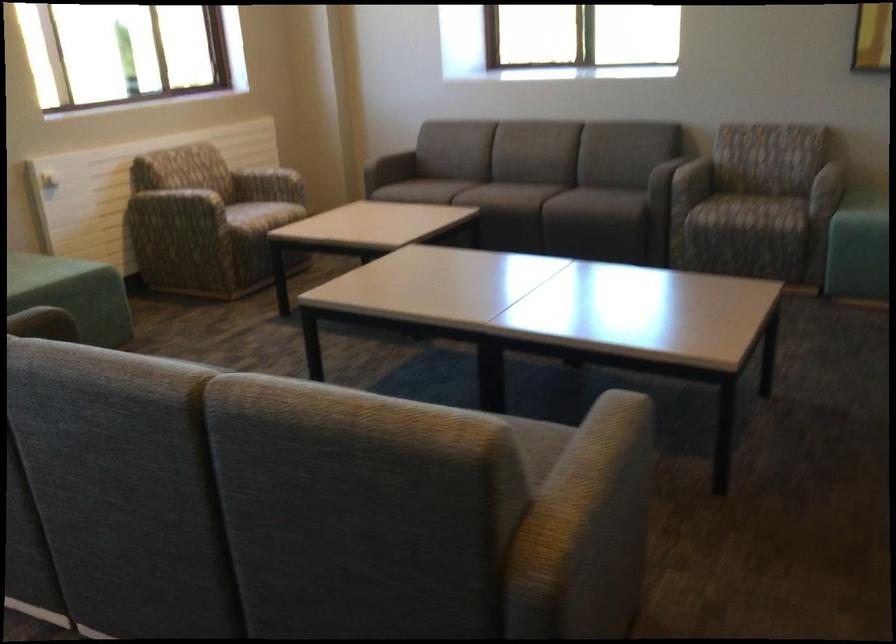
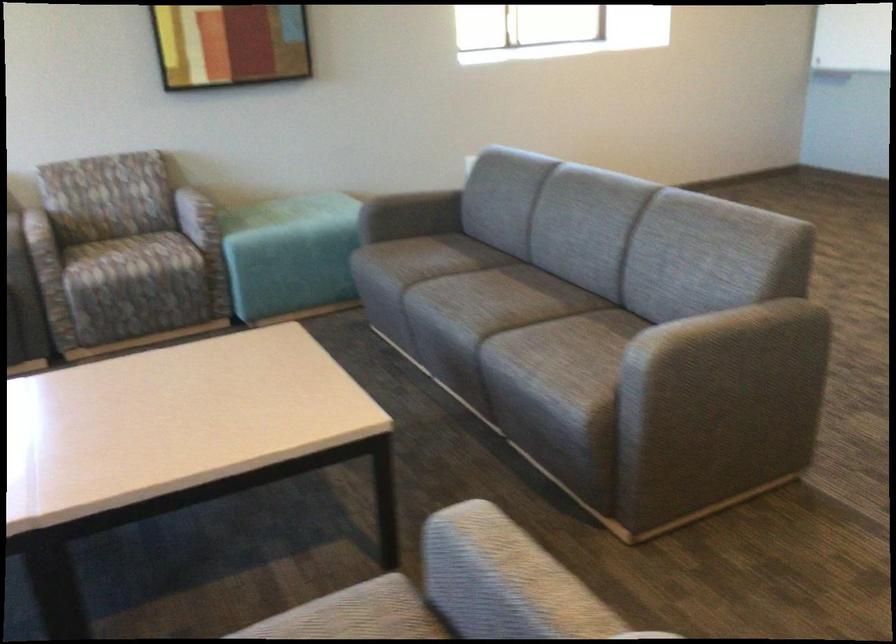
Question: I am providing you with two images of the same scene from different viewpoints. Please identify which objects are invisible in image2.

Choices:
 (A) sofa armrest
 (B) curved metal rod
 (C) light blue ottoman
 (D) sofa sitting surface

Answer: (A)